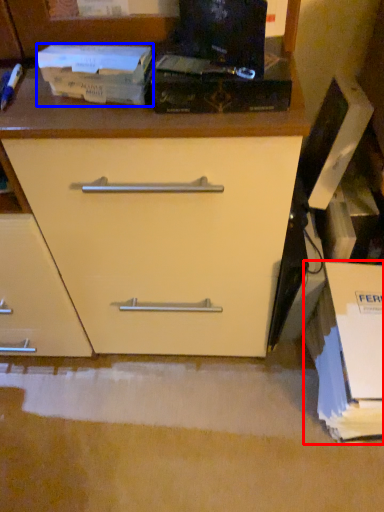
Question: Which point is further to the camera, cardboard box (highlighted by a red box) or paperback book (highlighted by a blue box)?

Choices:
 (A) cardboard box
 (B) paperback book

Answer: (A)